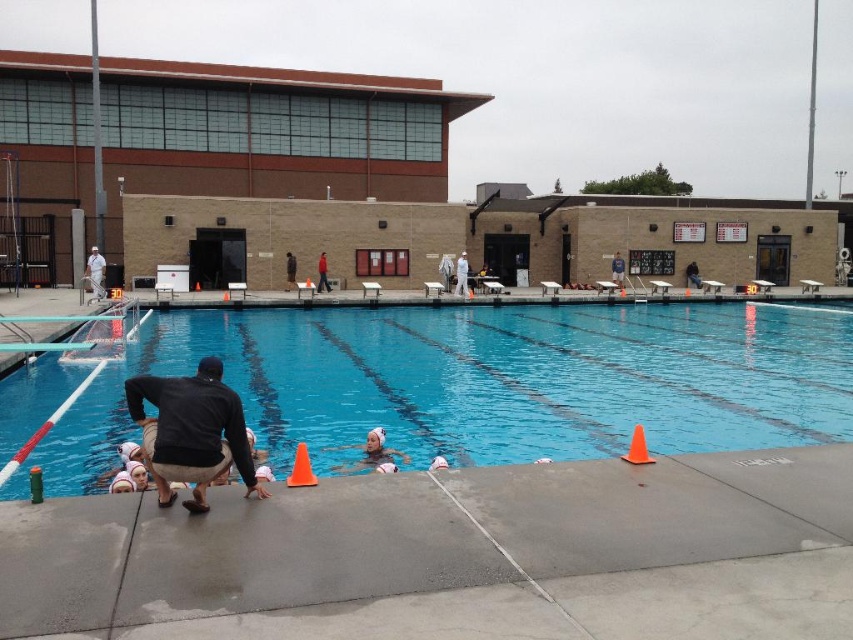
Question: Which object is the closest to the white matte swim cap at center?

Choices:
 (A) dark blue shirt at center
 (B) concrete at lower center
 (C) dark blue jeans at lower center
 (D) blue smooth water at lower center

Answer: (B)

Question: Does concrete at lower center have a larger size compared to black cotton shirt at lower left?

Choices:
 (A) yes
 (B) no

Answer: (B)

Question: Which point is closer to the camera taking this photo?

Choices:
 (A) (637, 436)
 (B) (322, 536)
 (C) (287, 266)
 (D) (465, 253)

Answer: (B)

Question: Where is concrete at lower center located in relation to orange plastic cone at lower right in the image?

Choices:
 (A) below
 (B) above

Answer: (A)

Question: Observing the image, what is the correct spatial positioning of black cotton shirt at lower left in reference to dark blue shirt at center?

Choices:
 (A) right
 (B) left

Answer: (A)

Question: Estimate the real-world distances between objects in this image. Which object is closer to the dark blue jeans at lower center?

Choices:
 (A) concrete at lower center
 (B) white matte uniform at center

Answer: (B)